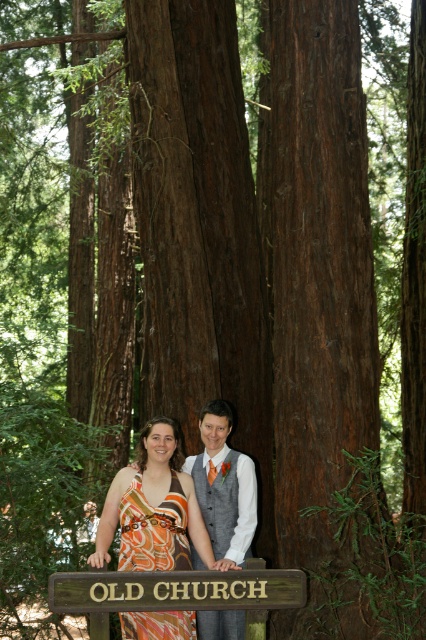
Can you confirm if orange printed dress at center is positioned to the left of gray textured vest at center?

Indeed, orange printed dress at center is positioned on the left side of gray textured vest at center.

Does orange printed dress at center have a greater width compared to gray textured vest at center?

Indeed, orange printed dress at center has a greater width compared to gray textured vest at center.

Between point (147, 520) and point (204, 440), which one is positioned behind?

The point (204, 440) is behind.

Locate an element on the screen. The image size is (426, 640). orange printed dress at center is located at coordinates (154, 508).

Is wooden sign at center behind gray textured vest at center?

No, wooden sign at center is in front of gray textured vest at center.

From the picture: Can you confirm if wooden sign at center is bigger than gray textured vest at center?

No, wooden sign at center is not bigger than gray textured vest at center.

Locate an element on the screen. This screenshot has height=640, width=426. wooden sign at center is located at coordinates (176, 589).

The width and height of the screenshot is (426, 640). What are the coordinates of `wooden sign at center` in the screenshot? It's located at click(x=176, y=589).

Which is below, orange printed dress at center or wooden sign at center?

wooden sign at center

Is orange printed dress at center to the left of wooden sign at center from the viewer's perspective?

Yes, orange printed dress at center is to the left of wooden sign at center.

Between point (129, 486) and point (86, 584), which one is positioned in front?

Positioned in front is point (86, 584).

Where is `orange printed dress at center`? The height and width of the screenshot is (640, 426). orange printed dress at center is located at coordinates click(x=154, y=508).